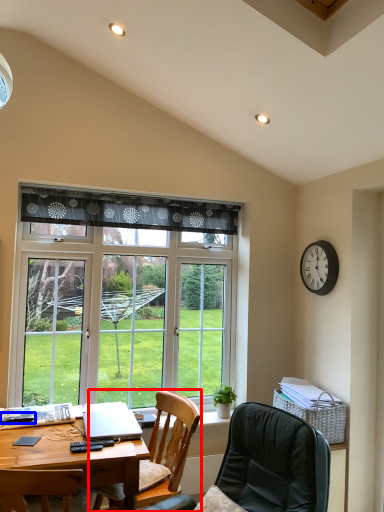
Question: Which of the following is the closest to the observer, chair (highlighted by a red box) or remote control (highlighted by a blue box)?

Choices:
 (A) chair
 (B) remote control

Answer: (A)